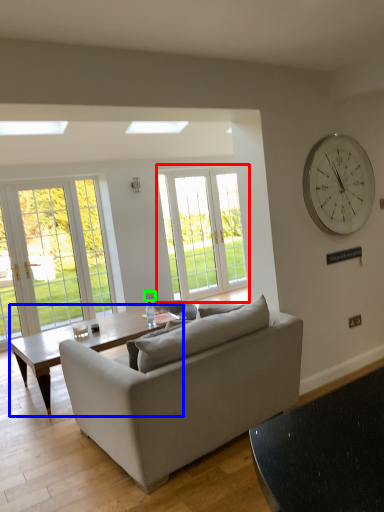
Question: Which is nearer to the window (highlighted by a red box)? coffee table (highlighted by a blue box) or power outlet (highlighted by a green box).

Choices:
 (A) coffee table
 (B) power outlet

Answer: (B)